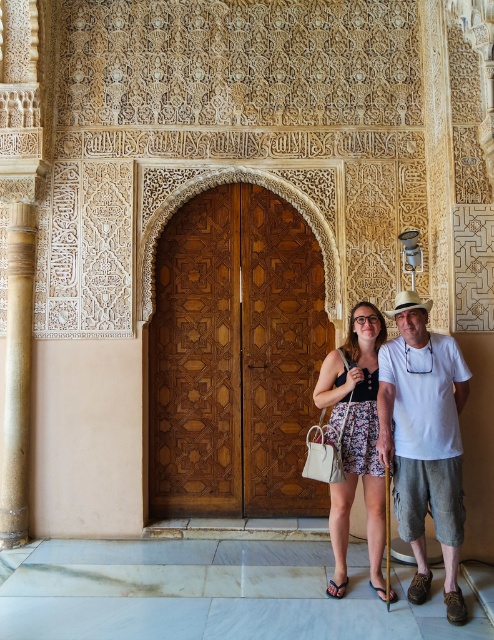
Does white cotton shirt at center have a greater width compared to blue fabric sandal at lower center?

Indeed, white cotton shirt at center has a greater width compared to blue fabric sandal at lower center.

Who is higher up, white cotton shirt at center or blue fabric sandal at lower center?

white cotton shirt at center

Is point (404, 490) in front of point (340, 589)?

Yes, it is in front of point (340, 589).

Where is `white cotton shirt at center`? This screenshot has height=640, width=494. white cotton shirt at center is located at coordinates (424, 440).

Does floral fabric dress at center have a smaller size compared to smooth brown column at left?

No.

At what (x,y) coordinates should I click in order to perform the action: click on floral fabric dress at center. Please return your answer as a coordinate pair (x, y). This screenshot has width=494, height=640. Looking at the image, I should click on (356, 435).

Is wooden carved door at center above brown leather sandal at lower center?

Correct, wooden carved door at center is located above brown leather sandal at lower center.

Is point (298, 321) positioned after point (380, 592)?

Yes, it is behind point (380, 592).

Image resolution: width=494 pixels, height=640 pixels. What are the coordinates of `wooden carved door at center` in the screenshot? It's located at (235, 356).